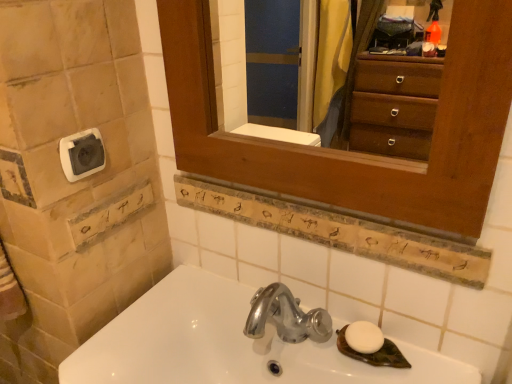
Question: Should I look upward or downward to see white stone tiles at left?

Choices:
 (A) down
 (B) up

Answer: (A)

Question: Is wooden medicine cabinet at upper center not inside wooden sign at center?

Choices:
 (A) yes
 (B) no

Answer: (A)

Question: From the image's perspective, is wooden medicine cabinet at upper center located beneath wooden sign at center?

Choices:
 (A) no
 (B) yes

Answer: (A)

Question: Considering the relative positions of wooden medicine cabinet at upper center and wooden sign at center in the image provided, is wooden medicine cabinet at upper center to the left of wooden sign at center from the viewer's perspective?

Choices:
 (A) yes
 (B) no

Answer: (A)

Question: Does wooden medicine cabinet at upper center have a lesser height compared to wooden sign at center?

Choices:
 (A) yes
 (B) no

Answer: (B)

Question: Is wooden medicine cabinet at upper center positioned far away from wooden sign at center?

Choices:
 (A) yes
 (B) no

Answer: (B)

Question: Could wooden sign at center be considered to be inside wooden medicine cabinet at upper center?

Choices:
 (A) no
 (B) yes

Answer: (A)

Question: Is wooden sign at center with wooden medicine cabinet at upper center?

Choices:
 (A) no
 (B) yes

Answer: (A)

Question: Could you tell me if wooden sign at center is facing wooden medicine cabinet at upper center?

Choices:
 (A) yes
 (B) no

Answer: (B)

Question: Does wooden sign at center have a greater width compared to wooden medicine cabinet at upper center?

Choices:
 (A) yes
 (B) no

Answer: (B)

Question: Does wooden sign at center have a lesser width compared to wooden medicine cabinet at upper center?

Choices:
 (A) no
 (B) yes

Answer: (B)

Question: From the image's perspective, does wooden sign at center appear lower than wooden medicine cabinet at upper center?

Choices:
 (A) no
 (B) yes

Answer: (B)

Question: From the image's perspective, is wooden sign at center on top of wooden medicine cabinet at upper center?

Choices:
 (A) no
 (B) yes

Answer: (A)

Question: From the image's perspective, does wooden sign at center appear lower than white plastic towel bar at upper left?

Choices:
 (A) no
 (B) yes

Answer: (B)